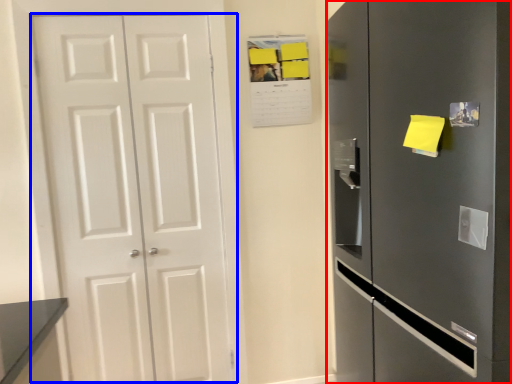
Question: Which object appears closest to the camera in this image, refrigerator (highlighted by a red box) or door (highlighted by a blue box)?

Choices:
 (A) refrigerator
 (B) door

Answer: (A)